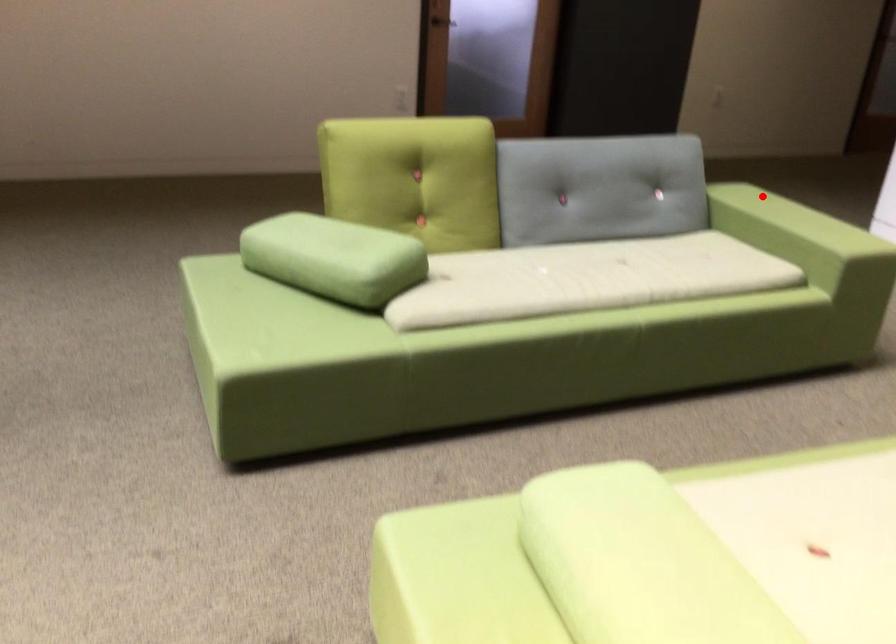
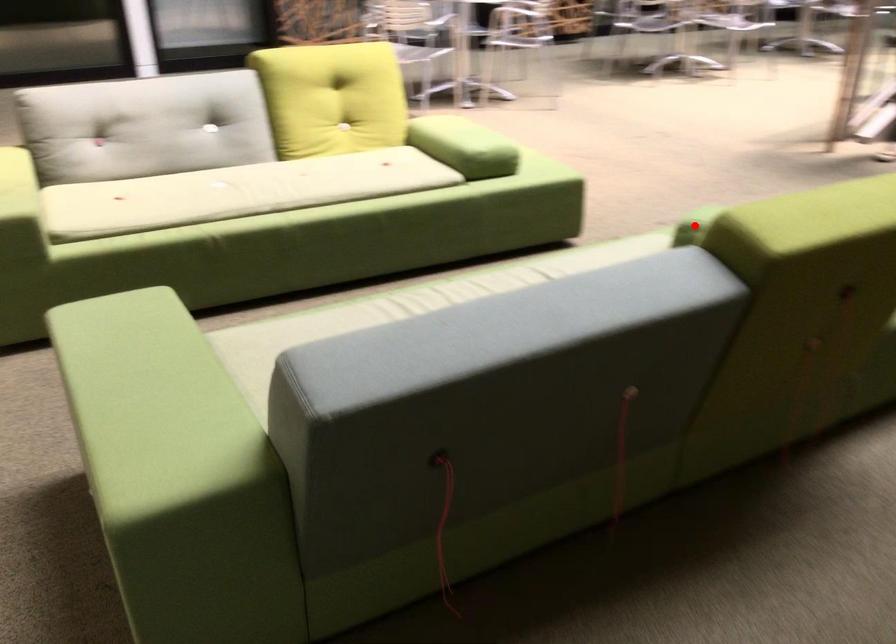
I am providing you with two images of the same scene from different viewpoints. A red point is marked on the first image and another point is marked on the second image. Does the point marked in image1 correspond to the same location as the one in image2?

No